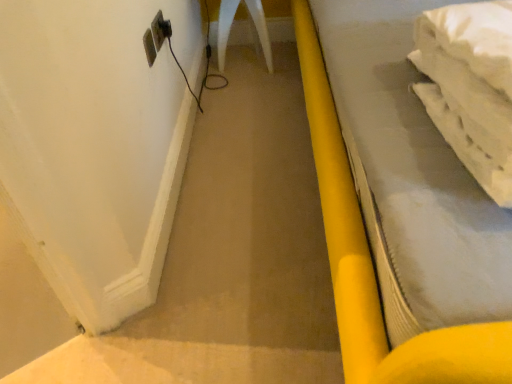
Question: Does white plastic electric outlet at upper left lie behind black plastic plug at upper left?

Choices:
 (A) yes
 (B) no

Answer: (B)

Question: Is the depth of white plastic electric outlet at upper left less than that of black plastic plug at upper left?

Choices:
 (A) no
 (B) yes

Answer: (B)

Question: Considering the relative sizes of white plastic electric outlet at upper left and black plastic plug at upper left in the image provided, is white plastic electric outlet at upper left wider than black plastic plug at upper left?

Choices:
 (A) yes
 (B) no

Answer: (B)

Question: Does white plastic electric outlet at upper left have a greater height compared to black plastic plug at upper left?

Choices:
 (A) no
 (B) yes

Answer: (B)

Question: Can you see white plastic electric outlet at upper left touching black plastic plug at upper left?

Choices:
 (A) no
 (B) yes

Answer: (B)

Question: Is white plastic electric outlet at upper left outside black plastic plug at upper left?

Choices:
 (A) no
 (B) yes

Answer: (B)

Question: Is black plastic plug at upper left far from white plastic electric outlet at upper left?

Choices:
 (A) no
 (B) yes

Answer: (A)

Question: From a real-world perspective, is black plastic plug at upper left below white plastic electric outlet at upper left?

Choices:
 (A) yes
 (B) no

Answer: (A)

Question: Is black plastic plug at upper left positioned before white plastic electric outlet at upper left?

Choices:
 (A) no
 (B) yes

Answer: (A)

Question: Does black plastic plug at upper left turn towards white plastic electric outlet at upper left?

Choices:
 (A) no
 (B) yes

Answer: (A)

Question: Is black plastic plug at upper left positioned behind white plastic electric outlet at upper left?

Choices:
 (A) no
 (B) yes

Answer: (B)

Question: Can you confirm if black plastic plug at upper left is shorter than white plastic electric outlet at upper left?

Choices:
 (A) no
 (B) yes

Answer: (B)

Question: Is yellow plastic bed at right to the right of white plastic electric outlet at upper left from the viewer's perspective?

Choices:
 (A) yes
 (B) no

Answer: (A)